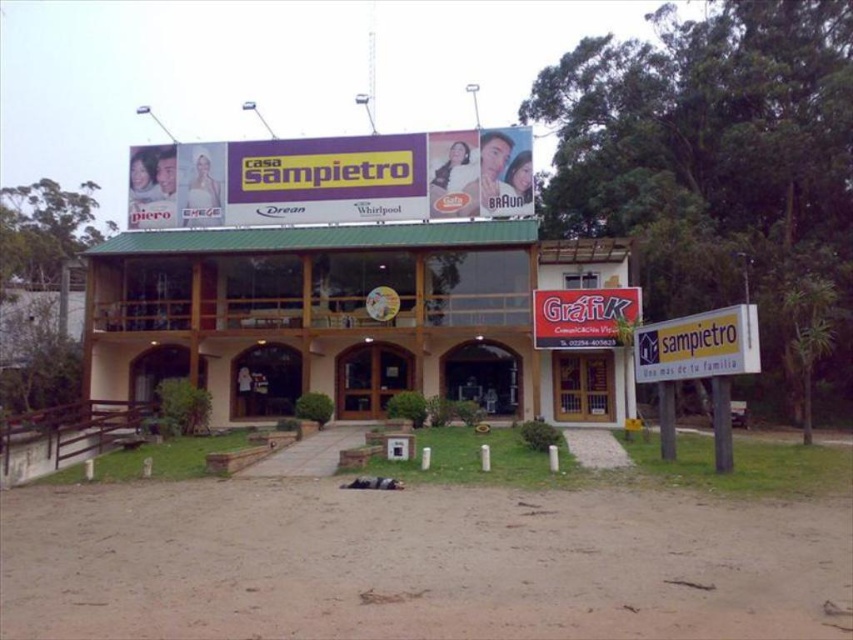
Is brown wooden hotel at center further to the viewer compared to white plastic sign at lower right?

That is True.

This screenshot has height=640, width=853. What do you see at coordinates (346, 316) in the screenshot?
I see `brown wooden hotel at center` at bounding box center [346, 316].

Find the location of a particular element. brown wooden hotel at center is located at coordinates (346, 316).

Which is more to the left, white plastic sign at lower right or red plastic sign at center?

From the viewer's perspective, red plastic sign at center appears more on the left side.

Who is taller, white plastic sign at lower right or red plastic sign at center?

With more height is red plastic sign at center.

Who is more forward, (755, 369) or (537, 324)?

Point (755, 369) is in front.

Where is `white plastic sign at lower right`? The width and height of the screenshot is (853, 640). white plastic sign at lower right is located at coordinates (698, 346).

Is brown wooden hotel at center above red plastic sign at center?

No, brown wooden hotel at center is not above red plastic sign at center.

Can you confirm if brown wooden hotel at center is smaller than red plastic sign at center?

No, brown wooden hotel at center is not smaller than red plastic sign at center.

I want to click on brown wooden hotel at center, so click(x=346, y=316).